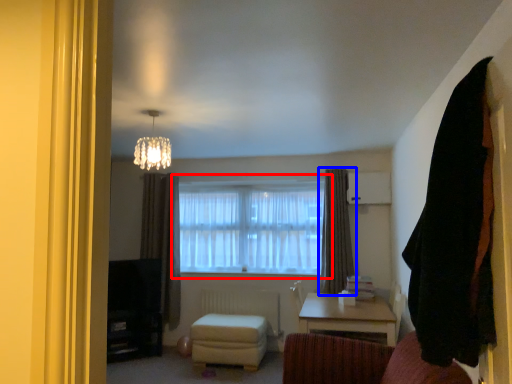
Question: Which point is further to the camera, window (highlighted by a red box) or curtain (highlighted by a blue box)?

Choices:
 (A) window
 (B) curtain

Answer: (A)